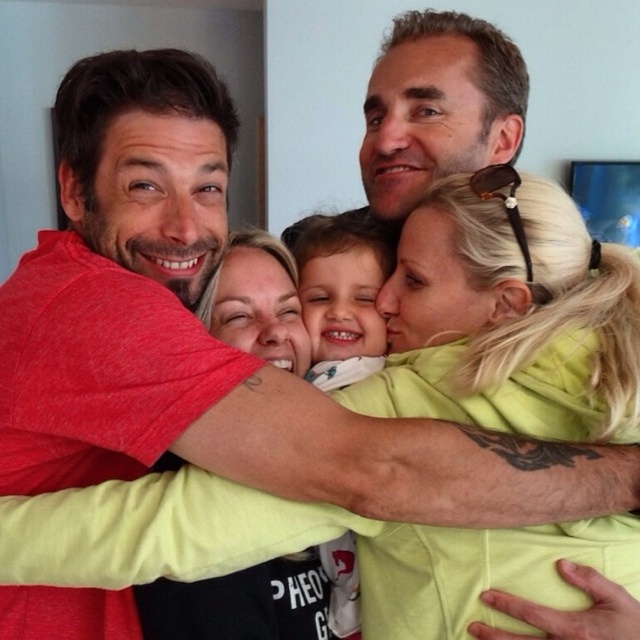
Question: Which of the following is the farthest from the observer?

Choices:
 (A) smooth white baby at center
 (B) blonde hair at upper right

Answer: (A)

Question: Which object appears closest to the camera in this image?

Choices:
 (A) blonde hair at upper right
 (B) white soft fabric at center
 (C) smooth white baby at center

Answer: (A)

Question: Which object appears farthest from the camera in this image?

Choices:
 (A) smooth white baby at center
 (B) blonde hair at upper right
 (C) white soft fabric at center

Answer: (C)

Question: Can you confirm if white soft fabric at center is bigger than smooth white baby at center?

Choices:
 (A) yes
 (B) no

Answer: (A)

Question: Is white soft fabric at center below smooth white baby at center?

Choices:
 (A) yes
 (B) no

Answer: (B)

Question: Is blonde hair at upper right bigger than white soft fabric at center?

Choices:
 (A) no
 (B) yes

Answer: (B)